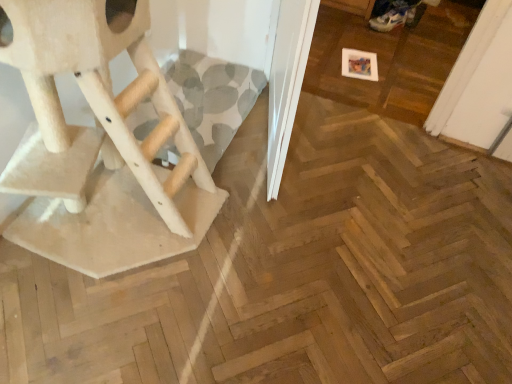
What are the coordinates of `vacant region to the right of beige carpeted cat tree at left` in the screenshot? It's located at (266, 251).